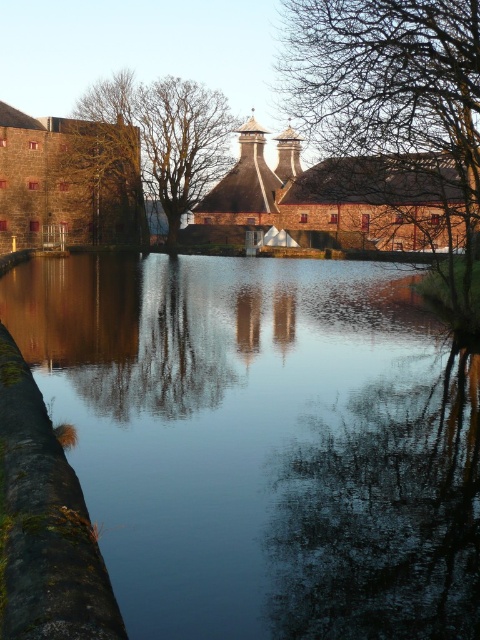
Question: Which is farther from the bare branches at upper center?

Choices:
 (A) bare wood tree at center
 (B) brown wood tree at upper left

Answer: (B)

Question: Is brown wood tree at upper left thinner than bare wood tree at center?

Choices:
 (A) yes
 (B) no

Answer: (A)

Question: Estimate the real-world distances between objects in this image. Which object is closer to the brown wood tree at upper left?

Choices:
 (A) smooth reflective water at center
 (B) bare branches at upper center
 (C) bare wood tree at center

Answer: (C)

Question: From the image, what is the correct spatial relationship of smooth reflective water at center in relation to bare wood tree at center?

Choices:
 (A) above
 (B) below

Answer: (B)

Question: Among these points, which one is farthest from the camera?

Choices:
 (A) (475, 52)
 (B) (164, 109)
 (C) (129, 230)
 (D) (430, 531)

Answer: (B)

Question: Does smooth reflective water at center appear under brown wood tree at upper left?

Choices:
 (A) no
 (B) yes

Answer: (B)